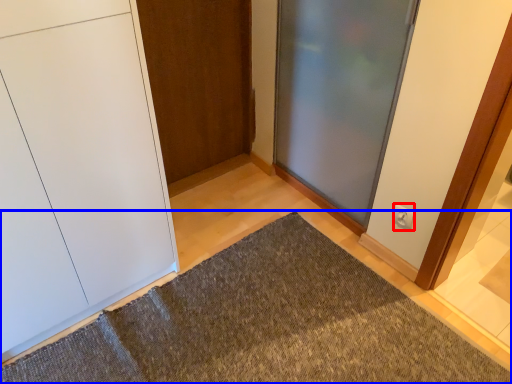
Question: Among these objects, which one is farthest to the camera, electric outlet (highlighted by a red box) or doormat (highlighted by a blue box)?

Choices:
 (A) electric outlet
 (B) doormat

Answer: (A)